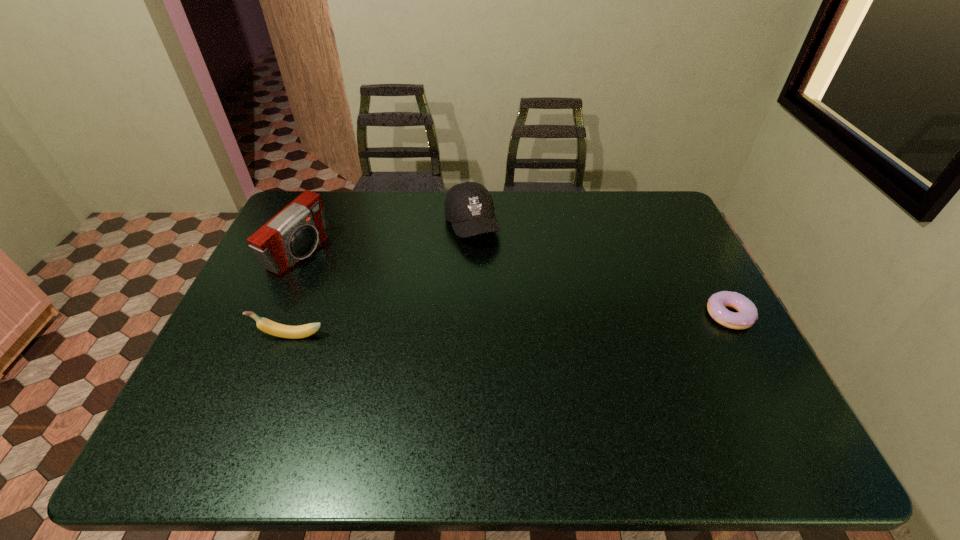
In the image, there is a desktop. What are the coordinates of `vacant area at the far edge` in the screenshot? It's located at (341, 224).

I want to click on blank space at the left edge, so click(251, 279).

Image resolution: width=960 pixels, height=540 pixels. In the image, there is a desktop. What are the coordinates of `free space at the right edge` in the screenshot? It's located at (704, 313).

The image size is (960, 540). In the image, there is a desktop. Identify the location of vacant space at the far left corner. (324, 202).

This screenshot has width=960, height=540. I want to click on free space at the far right corner of the desktop, so click(x=639, y=213).

Identify the location of unoccupied position between the camera and the baseball cap. This screenshot has width=960, height=540. (385, 239).

Find the location of a particular element. This screenshot has width=960, height=540. free space between the tallest object and the shortest object is located at coordinates (514, 285).

The height and width of the screenshot is (540, 960). Find the location of `free point between the camera and the third tallest object`. free point between the camera and the third tallest object is located at coordinates (295, 294).

Locate an element on the screen. The width and height of the screenshot is (960, 540). unoccupied position between the third object from left to right and the third tallest object is located at coordinates (381, 280).

Image resolution: width=960 pixels, height=540 pixels. I want to click on free spot between the second shortest object and the camera, so click(x=295, y=294).